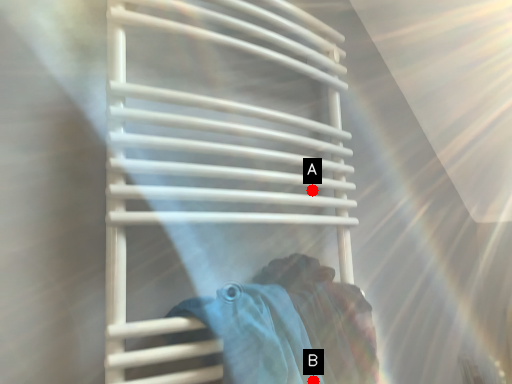
Question: Two points are circled on the image, labeled by A and B beside each circle. Which point is further to the camera?

Choices:
 (A) A is further
 (B) B is further

Answer: (A)